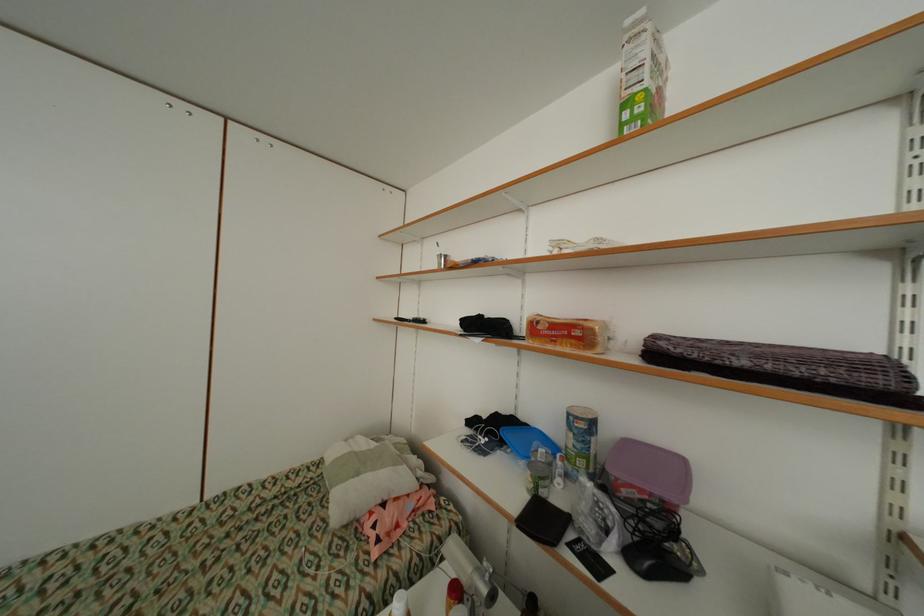
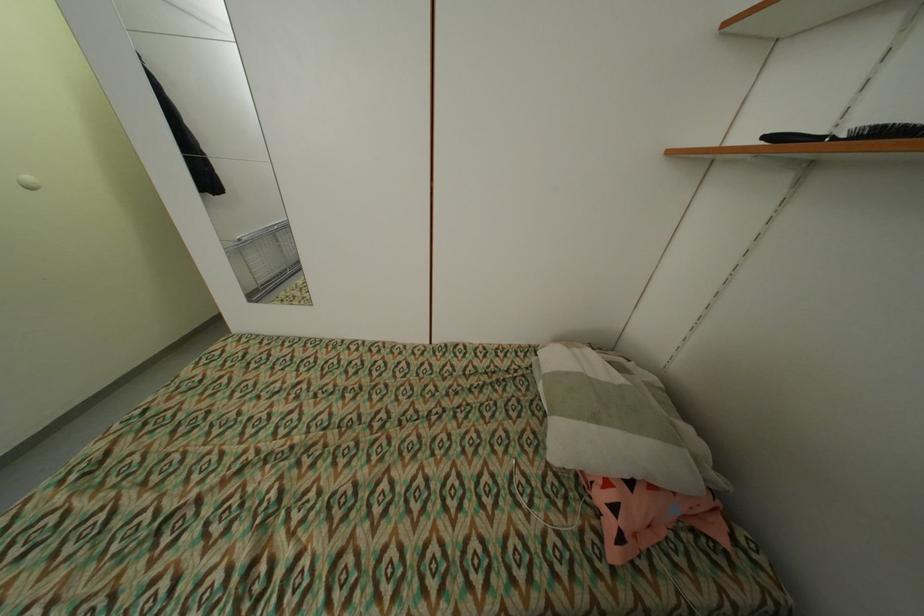
In the second image, find the point that corresponds to point (416, 322) in the first image.

(841, 140)